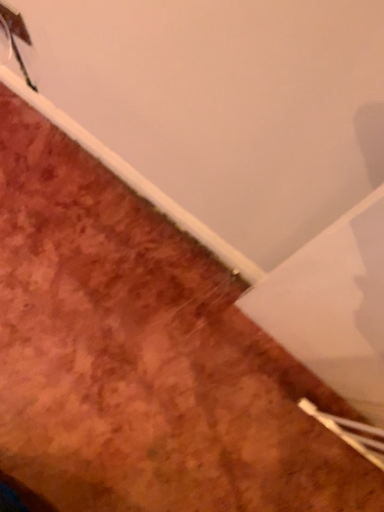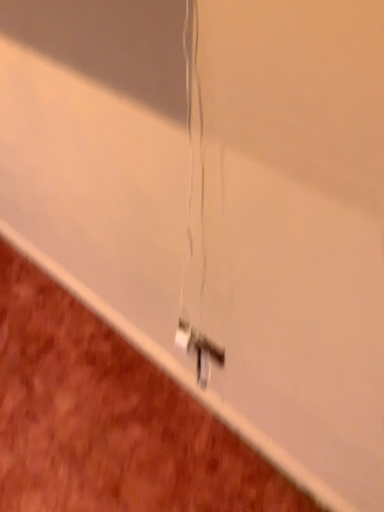
Question: Which way did the camera rotate in the video?

Choices:
 (A) rotated upward
 (B) rotated downward

Answer: (A)